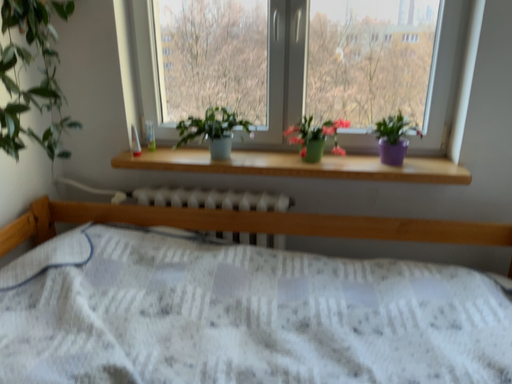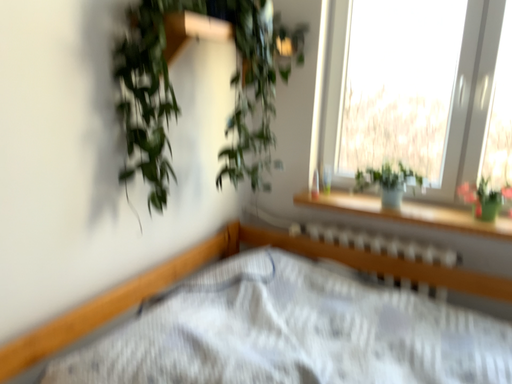
Question: How did the camera likely rotate when shooting the video?

Choices:
 (A) rotated upward
 (B) rotated downward

Answer: (A)